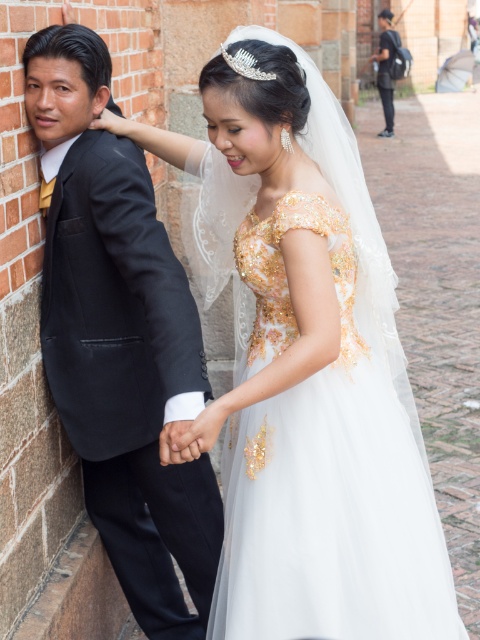
Question: Where is matte black suit at left located in relation to dark blue jeans at upper right in the image?

Choices:
 (A) below
 (B) above

Answer: (A)

Question: Does white tulle dress at center have a larger size compared to dark blue jeans at upper right?

Choices:
 (A) no
 (B) yes

Answer: (A)

Question: Which is farther from the white tulle dress at center?

Choices:
 (A) matte black suit at left
 (B) dark blue jeans at upper right

Answer: (B)

Question: Can you confirm if matte black suit at left is smaller than dark blue jeans at upper right?

Choices:
 (A) yes
 (B) no

Answer: (A)

Question: Which point is farther to the camera?

Choices:
 (A) (141, 504)
 (B) (412, 522)
 (C) (377, 88)

Answer: (C)

Question: Among these points, which one is farthest from the camera?

Choices:
 (A) (393, 115)
 (B) (63, 205)
 (C) (287, 289)

Answer: (A)